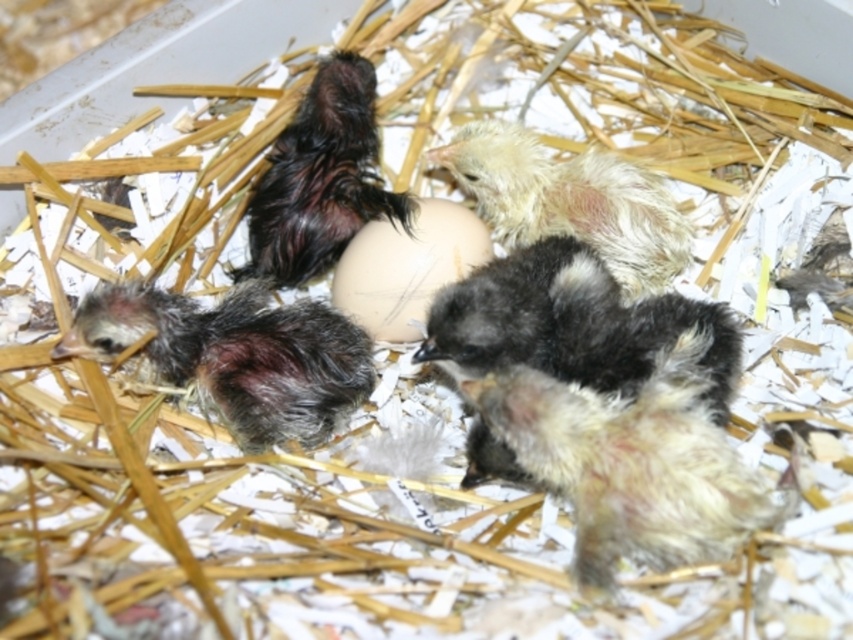
You are a farmer checking the newly hatched chicks in the container. You notice two points marked in the image. Which point is closer to you, point (622, 237) or point (384, 189)?

Point (622, 237) is closer to the viewer than point (384, 189).

You are a farmer checking on the newly hatched chicks. You need to locate the fluffy white chicken at center. According to the coordinates provided, where exactly is it positioned?

The fluffy white chicken at center is positioned at coordinates point (631,461).

You are a farmer checking on the chicks. You need to pick up the fluffy white chicken at center and the fluffy black chick at center. Which one should you pick up first to avoid stepping on the other?

You should pick up the fluffy white chicken at center first because it is closer to you than the fluffy black chick at center, so reaching it first would prevent stepping on the other chick.